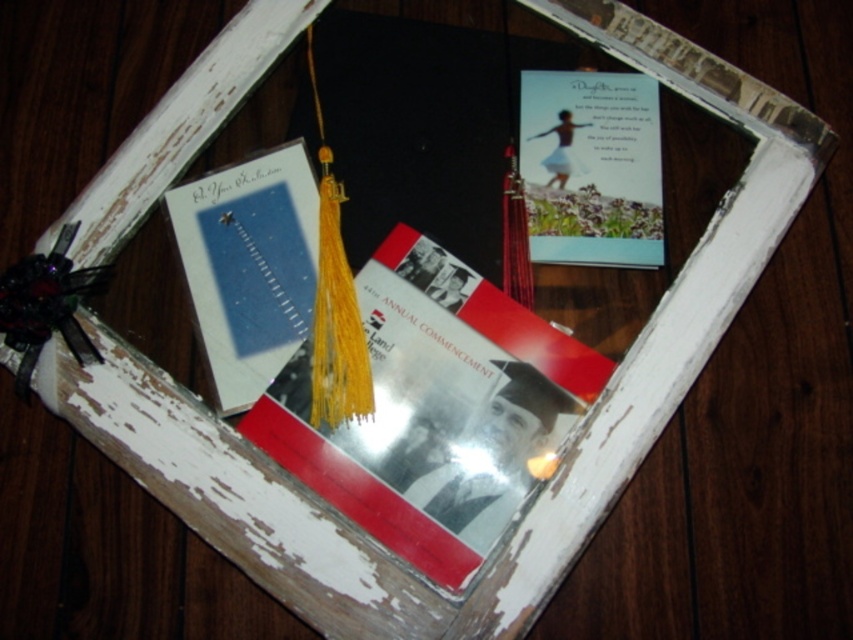
Who is more distant from viewer, (262, 268) or (575, 243)?

The point (575, 243) is behind.

Who is positioned more to the left, white paper card at left or matte paper card at upper right?

Positioned to the left is white paper card at left.

Identify the location of white paper card at left. This screenshot has height=640, width=853. (248, 266).

Is white paper card at left above black silky tassel at lower left?

Yes.

Based on the photo, is white paper card at left closer to the viewer compared to black silky tassel at lower left?

That is False.

Is point (244, 316) positioned after point (62, 323)?

Yes, it is behind point (62, 323).

What are the coordinates of `white paper card at left` in the screenshot? It's located at (248, 266).

Is matte paper card at upper right taller than black silky tassel at lower left?

Indeed, matte paper card at upper right has a greater height compared to black silky tassel at lower left.

Between matte paper card at upper right and black silky tassel at lower left, which one has less height?

With less height is black silky tassel at lower left.

Which is in front, point (540, 227) or point (65, 266)?

Point (65, 266) is in front.

I want to click on matte paper card at upper right, so click(590, 168).